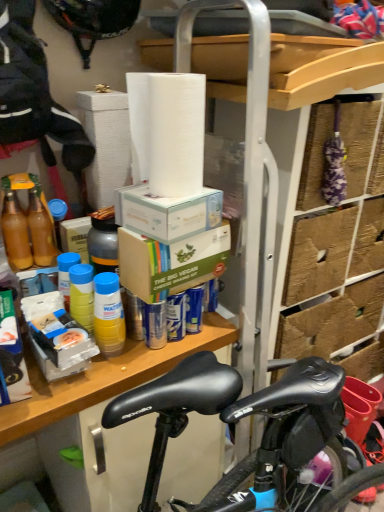
Question: Is wooden shelf at center to the right of translucent plastic bottle at shelf center, which is the third bottle from right to left, from the viewer's perspective?

Choices:
 (A) no
 (B) yes

Answer: (B)

Question: Are wooden shelf at center and translucent plastic bottle at shelf center, which is the third bottle from right to left, located far from each other?

Choices:
 (A) yes
 (B) no

Answer: (B)

Question: Could you tell me if wooden shelf at center is facing translucent plastic bottle at shelf center, which appears as the first bottle when viewed from the left?

Choices:
 (A) no
 (B) yes

Answer: (A)

Question: Considering the relative positions of wooden shelf at center and translucent plastic bottle at shelf center, which is the third bottle from right to left, in the image provided, is wooden shelf at center to the left of translucent plastic bottle at shelf center, which is the third bottle from right to left, from the viewer's perspective?

Choices:
 (A) no
 (B) yes

Answer: (A)

Question: Can you confirm if wooden shelf at center is smaller than translucent plastic bottle at shelf center, which appears as the first bottle when viewed from the left?

Choices:
 (A) no
 (B) yes

Answer: (A)

Question: Considering the positions of point (107, 30) and point (0, 445), is point (107, 30) closer or farther from the camera than point (0, 445)?

Choices:
 (A) farther
 (B) closer

Answer: (B)

Question: Looking at the image, does black matte helmet at upper left seem bigger or smaller compared to wooden shelf at center?

Choices:
 (A) big
 (B) small

Answer: (B)

Question: In terms of height, does black matte helmet at upper left look taller or shorter compared to wooden shelf at center?

Choices:
 (A) tall
 (B) short

Answer: (B)

Question: Relative to wooden shelf at center, is black matte helmet at upper left in front or behind?

Choices:
 (A) front
 (B) behind

Answer: (B)

Question: Is yellow plastic bottle at lower left, the third bottle from the left, situated inside wooden shelf at center or outside?

Choices:
 (A) inside
 (B) outside

Answer: (B)

Question: From their relative heights in the image, would you say yellow plastic bottle at lower left, the third bottle from the left, is taller or shorter than wooden shelf at center?

Choices:
 (A) tall
 (B) short

Answer: (B)

Question: Considering the positions of point (120, 350) and point (94, 373), is point (120, 350) closer or farther from the camera than point (94, 373)?

Choices:
 (A) farther
 (B) closer

Answer: (A)

Question: Considering their positions, is yellow plastic bottle at lower left, the third bottle from the left, located in front of or behind wooden shelf at center?

Choices:
 (A) behind
 (B) front

Answer: (B)

Question: Is black matte helmet at upper left wider or thinner than white cardboard box at upper center, which is the 2th box from bottom to top?

Choices:
 (A) wide
 (B) thin

Answer: (B)

Question: Is point (84, 13) closer or farther from the camera than point (187, 233)?

Choices:
 (A) farther
 (B) closer

Answer: (A)